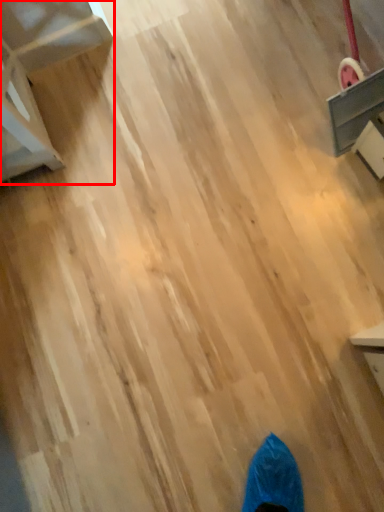
Question: From the image's perspective, what is the correct spatial relationship of furniture (annotated by the red box) in relation to furniture?

Choices:
 (A) above
 (B) below

Answer: (B)